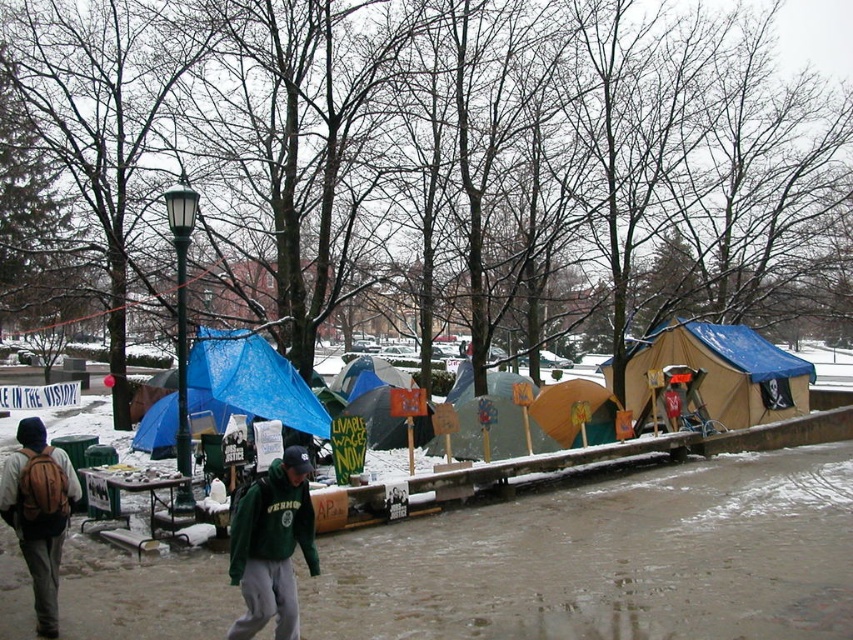
Does tan canvas tent at center-right have a lesser width compared to matte brown backpack at lower left?

Yes, tan canvas tent at center-right is thinner than matte brown backpack at lower left.

This screenshot has width=853, height=640. Describe the element at coordinates (724, 372) in the screenshot. I see `tan canvas tent at center-right` at that location.

Does point (787, 396) come farther from viewer compared to point (74, 488)?

Yes.

Where is `tan canvas tent at center-right`? This screenshot has width=853, height=640. tan canvas tent at center-right is located at coordinates (724, 372).

Does tan canvas tent at center-right have a lesser height compared to yellow fabric tent at center?

Indeed, tan canvas tent at center-right has a lesser height compared to yellow fabric tent at center.

How much distance is there between tan canvas tent at center-right and yellow fabric tent at center?

tan canvas tent at center-right and yellow fabric tent at center are 6.39 meters apart.

Between point (804, 371) and point (567, 429), which one is positioned in front?

Point (567, 429) is in front.

I want to click on tan canvas tent at center-right, so click(724, 372).

Who is lower down, yellow fabric tent at center or blue tarp tent at center?

yellow fabric tent at center is below.

Does yellow fabric tent at center appear on the left side of blue tarp tent at center?

Incorrect, yellow fabric tent at center is not on the left side of blue tarp tent at center.

Does point (602, 396) come in front of point (358, 364)?

Yes, point (602, 396) is closer to viewer.

Where is `yellow fabric tent at center`? yellow fabric tent at center is located at coordinates (566, 406).